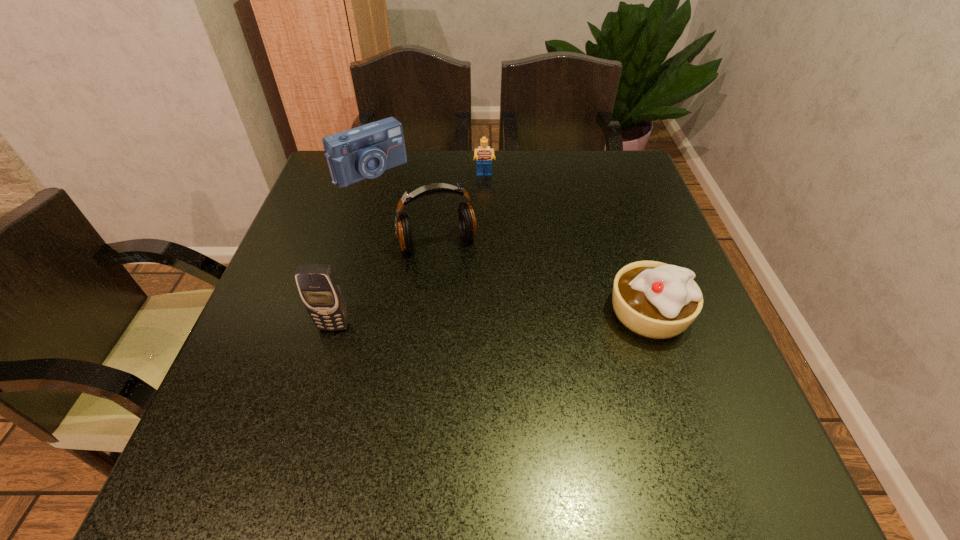
Locate an element on the screen. This screenshot has width=960, height=540. vacant position located 0.390m on the face of the Lego is located at coordinates (490, 285).

I want to click on free spot located on the face of the Lego, so tap(488, 237).

In order to click on free space located 0.100m on the face of the Lego in this screenshot , I will do `click(486, 205)`.

Locate an element on the screen. The width and height of the screenshot is (960, 540). vacant space located on the lens of the camera is located at coordinates [x=451, y=248].

Identify the location of vacant space located on the lens of the camera. The height and width of the screenshot is (540, 960). (431, 228).

What are the coordinates of `vacant space positioned on the lens of the camera` in the screenshot? It's located at (413, 210).

This screenshot has height=540, width=960. In order to click on Lego that is at the far edge in this screenshot , I will do `click(484, 154)`.

Identify the location of camera present at the far edge. (366, 151).

Locate an element on the screen. The image size is (960, 540). cellular telephone that is at the left edge is located at coordinates (320, 290).

Image resolution: width=960 pixels, height=540 pixels. I want to click on camera located at the left edge, so click(x=366, y=151).